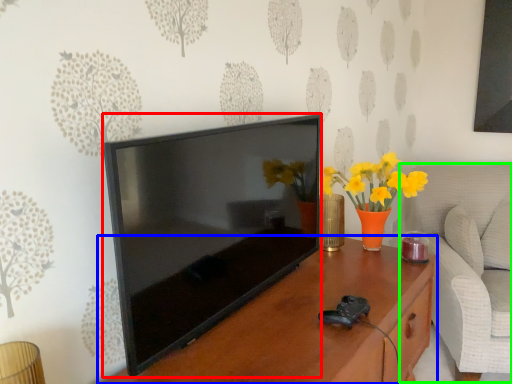
Question: Which is nearer to the television (highlighted by a red box)? table (highlighted by a blue box) or swivel chair (highlighted by a green box).

Choices:
 (A) table
 (B) swivel chair

Answer: (A)